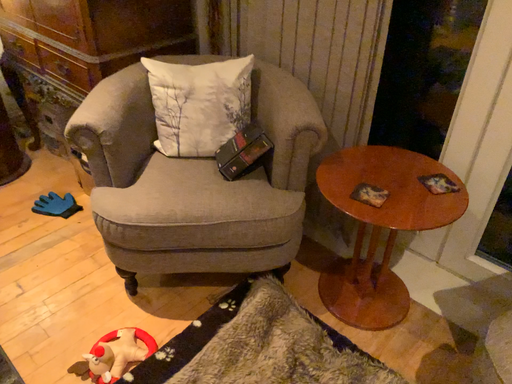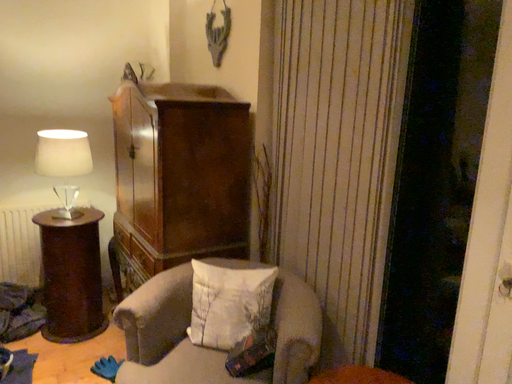
Question: How did the camera likely rotate when shooting the video?

Choices:
 (A) rotated right
 (B) rotated left

Answer: (B)